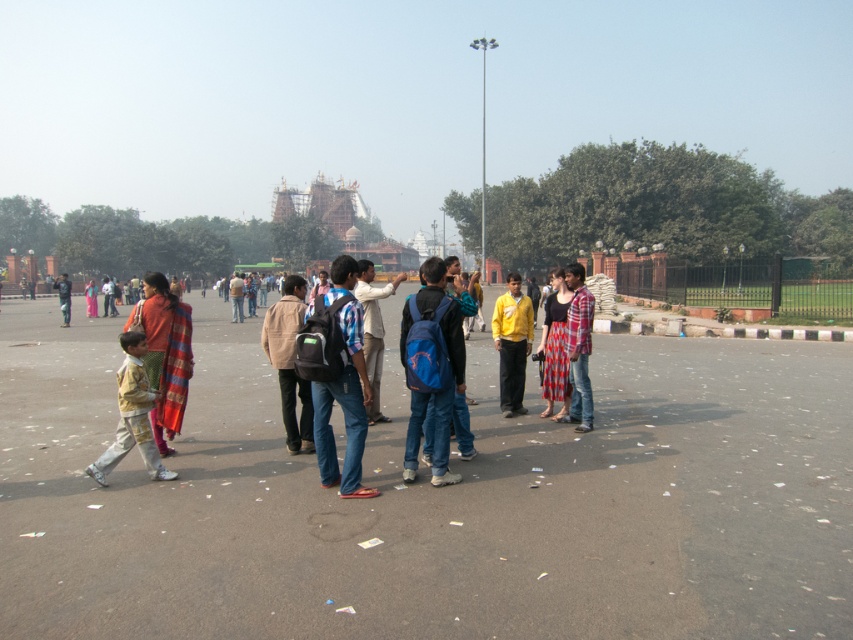
You are standing at the point with coordinates point (549,406) in the public square. You want to walk to the point with coordinates point (503,323). In which direction should you move relative to your current position?

You should move backward because point (503,323) is behind point (549,406) from your current position.

Consider the image. You are a photographer trying to capture a candid shot of the red plaid skirt at center and the plaid shirt at center in the public square. Your camera has a lens that can focus on objects within a 12 inch range. Will both items be in focus if you set the focus point exactly between them?

The red plaid skirt at center is 13.15 inches away from the plaid shirt at center. If the focus point is set exactly between them, the distance from each item to the focus point would be about 6.575 inches. Since the camera lens can focus within a 12 inch range, both items will be within the acceptable focus range and should appear sharp in the photo.